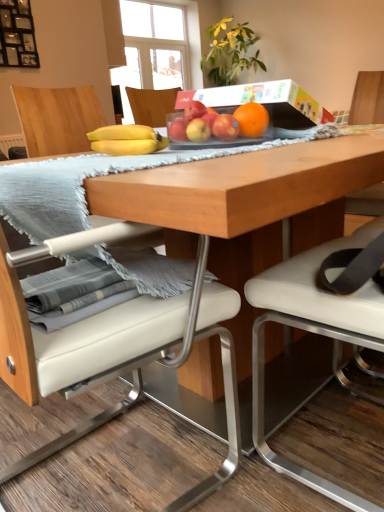
Question: Is yellow matte apple at center, which is counted as the 2th apple, starting from the right, taller than white leather chair at center, the second chair in the left-to-right sequence?

Choices:
 (A) no
 (B) yes

Answer: (A)

Question: From the image's perspective, is yellow matte apple at center, the 3th apple when ordered from left to right, located above white leather chair at center, the second chair in the left-to-right sequence?

Choices:
 (A) yes
 (B) no

Answer: (A)

Question: Is yellow matte apple at center, the 3th apple when ordered from left to right, shorter than white leather chair at center, positioned as the first chair in right-to-left order?

Choices:
 (A) yes
 (B) no

Answer: (A)

Question: From the image's perspective, is yellow matte apple at center, which is counted as the 2th apple, starting from the right, below white leather chair at center, the second chair in the left-to-right sequence?

Choices:
 (A) yes
 (B) no

Answer: (B)

Question: Is yellow matte apple at center, which is counted as the 2th apple, starting from the right, at the left side of white leather chair at center, the second chair in the left-to-right sequence?

Choices:
 (A) no
 (B) yes

Answer: (B)

Question: From the image's perspective, is yellow matte apple at center, the 3th apple when ordered from left to right, positioned above or below red matte apple at center, arranged as the third apple when viewed from the right?

Choices:
 (A) above
 (B) below

Answer: (B)

Question: Considering the relative positions of yellow matte apple at center, the 3th apple when ordered from left to right, and red matte apple at center, arranged as the third apple when viewed from the right, in the image provided, is yellow matte apple at center, the 3th apple when ordered from left to right, to the left or to the right of red matte apple at center, arranged as the third apple when viewed from the right,?

Choices:
 (A) left
 (B) right

Answer: (B)

Question: Is point click(x=200, y=133) closer or farther from the camera than point click(x=188, y=114)?

Choices:
 (A) farther
 (B) closer

Answer: (B)

Question: Is yellow matte apple at center, the 3th apple when ordered from left to right, taller or shorter than red matte apple at center, arranged as the third apple when viewed from the right?

Choices:
 (A) tall
 (B) short

Answer: (B)

Question: Considering the relative positions of red matte apple at center, the 1th apple positioned from the left, and white leather chair at center, marked as the 1th chair in a left-to-right arrangement, in the image provided, is red matte apple at center, the 1th apple positioned from the left, to the left or to the right of white leather chair at center, marked as the 1th chair in a left-to-right arrangement,?

Choices:
 (A) left
 (B) right

Answer: (B)

Question: Is red matte apple at center, acting as the 4th apple starting from the right, in front of or behind white leather chair at center, marked as the 1th chair in a left-to-right arrangement, in the image?

Choices:
 (A) front
 (B) behind

Answer: (B)

Question: From their relative heights in the image, would you say red matte apple at center, the 1th apple positioned from the left, is taller or shorter than white leather chair at center, placed as the second chair when sorted from right to left?

Choices:
 (A) tall
 (B) short

Answer: (B)

Question: Is point (177, 136) closer or farther from the camera than point (1, 282)?

Choices:
 (A) farther
 (B) closer

Answer: (A)

Question: From a real-world perspective, relative to red matte apple at center, arranged as the third apple when viewed from the right, is white leather chair at center, marked as the 1th chair in a left-to-right arrangement, vertically above or below?

Choices:
 (A) below
 (B) above

Answer: (A)

Question: Based on their sizes in the image, would you say white leather chair at center, placed as the second chair when sorted from right to left, is bigger or smaller than red matte apple at center, placed as the second apple when sorted from left to right?

Choices:
 (A) small
 (B) big

Answer: (B)